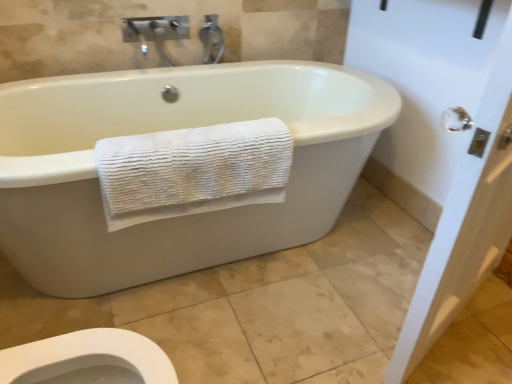
Question: In terms of size, does white textured towel at lower left appear bigger or smaller than white glossy door handle at upper right?

Choices:
 (A) small
 (B) big

Answer: (A)

Question: Does point (192, 210) appear closer or farther from the camera than point (438, 59)?

Choices:
 (A) farther
 (B) closer

Answer: (B)

Question: Is white textured towel at lower left inside or outside of white glossy door handle at upper right?

Choices:
 (A) inside
 (B) outside

Answer: (B)

Question: From the image's perspective, is white glossy door handle at upper right positioned above or below white textured towel at lower left?

Choices:
 (A) below
 (B) above

Answer: (A)

Question: From a real-world perspective, is white glossy door handle at upper right positioned above or below white textured towel at lower left?

Choices:
 (A) above
 (B) below

Answer: (A)

Question: Considering their positions, is white glossy door handle at upper right located in front of or behind white textured towel at lower left?

Choices:
 (A) front
 (B) behind

Answer: (A)

Question: Is white glossy door handle at upper right taller or shorter than white textured towel at lower left?

Choices:
 (A) tall
 (B) short

Answer: (A)